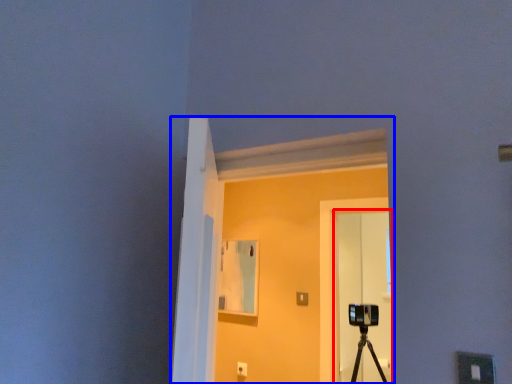
Question: Which of the following is the farthest to the observer, glass door (highlighted by a red box) or window (highlighted by a blue box)?

Choices:
 (A) glass door
 (B) window

Answer: (A)